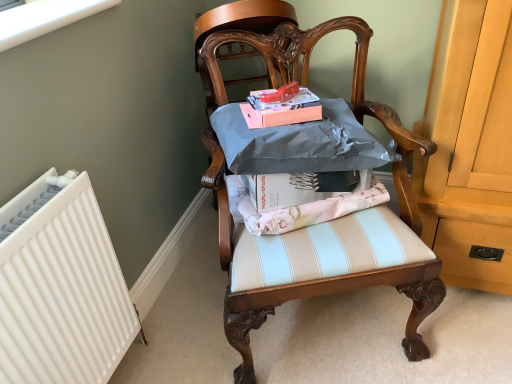
Question: Is there a large distance between matte silver wrapping paper at center and wooden chair at center?

Choices:
 (A) no
 (B) yes

Answer: (A)

Question: Does matte silver wrapping paper at center have a lesser height compared to wooden chair at center?

Choices:
 (A) no
 (B) yes

Answer: (B)

Question: Is matte silver wrapping paper at center facing towards wooden chair at center?

Choices:
 (A) no
 (B) yes

Answer: (B)

Question: Can we say matte silver wrapping paper at center lies outside wooden chair at center?

Choices:
 (A) yes
 (B) no

Answer: (B)

Question: Is the depth of matte silver wrapping paper at center greater than that of wooden chair at center?

Choices:
 (A) no
 (B) yes

Answer: (B)

Question: Can you confirm if matte silver wrapping paper at center is bigger than wooden chair at center?

Choices:
 (A) yes
 (B) no

Answer: (B)

Question: From the image's perspective, would you say wooden chair at center is positioned over matte silver wrapping paper at center?

Choices:
 (A) no
 (B) yes

Answer: (A)

Question: Can you confirm if wooden chair at center is taller than matte silver wrapping paper at center?

Choices:
 (A) yes
 (B) no

Answer: (A)

Question: Are wooden chair at center and matte silver wrapping paper at center located far from each other?

Choices:
 (A) no
 (B) yes

Answer: (A)

Question: Is the position of wooden chair at center more distant than that of matte silver wrapping paper at center?

Choices:
 (A) no
 (B) yes

Answer: (A)

Question: Does wooden chair at center appear on the left side of matte silver wrapping paper at center?

Choices:
 (A) no
 (B) yes

Answer: (A)

Question: Considering the relative sizes of wooden chair at center and matte silver wrapping paper at center in the image provided, is wooden chair at center smaller than matte silver wrapping paper at center?

Choices:
 (A) yes
 (B) no

Answer: (B)

Question: Can you confirm if matte silver wrapping paper at center is smaller than matte pink magazine at center?

Choices:
 (A) yes
 (B) no

Answer: (B)